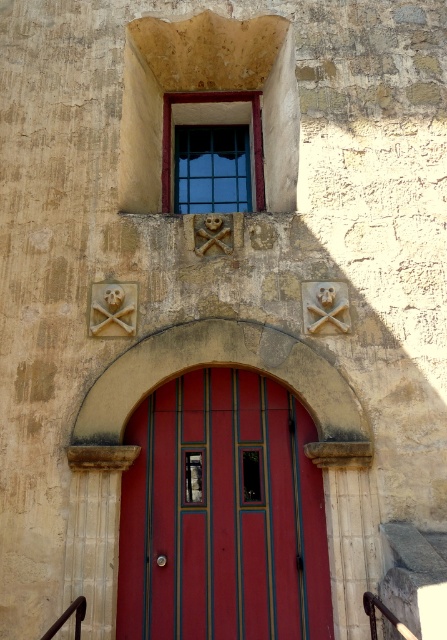
You are standing in front of a building and want to reach the smooth glossy wood door at center. If your maximum comfortable reach is 1.8 meters, can you touch the door without moving closer?

The distance between you and the smooth glossy wood door at center is 5.22 meters, which is greater than your 1.8 meter reach. Therefore, you cannot touch the door without moving closer.

You are an architect designing a new building and want to ensure that the smooth glossy wood door at center and the clear glass window at upper center are proportionate. Based on the current design, which object is larger and might need adjustment to achieve balance?

The smooth glossy wood door at center is bigger than the clear glass window at upper center, so the door may need to be reduced in size or the window enlarged to achieve a more balanced proportion.

You are a painter who needs to decide whether to bring a ladder or a step stool to paint the smooth glossy wood door at center and the gray stone stair at lower right. Based on their heights, which tool should you choose for each object?

The smooth glossy wood door at center is taller than the gray stone stair at lower right. Therefore, you should use a ladder for the smooth glossy wood door at center and a step stool for the gray stone stair at lower right.